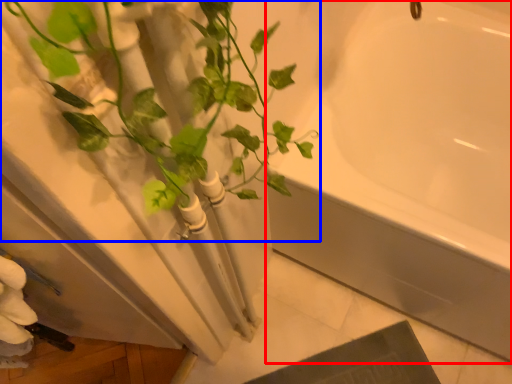
Question: Which point is further to the camera, bathtub (highlighted by a red box) or houseplant (highlighted by a blue box)?

Choices:
 (A) bathtub
 (B) houseplant

Answer: (A)